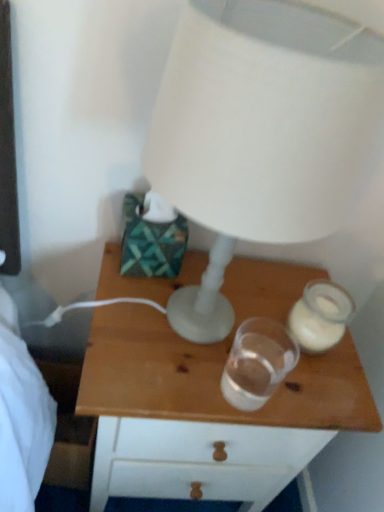
Locate an element on the screen. This screenshot has height=512, width=384. vacant space in white matte lamp at upper center (from a real-world perspective) is located at coordinates (172, 318).